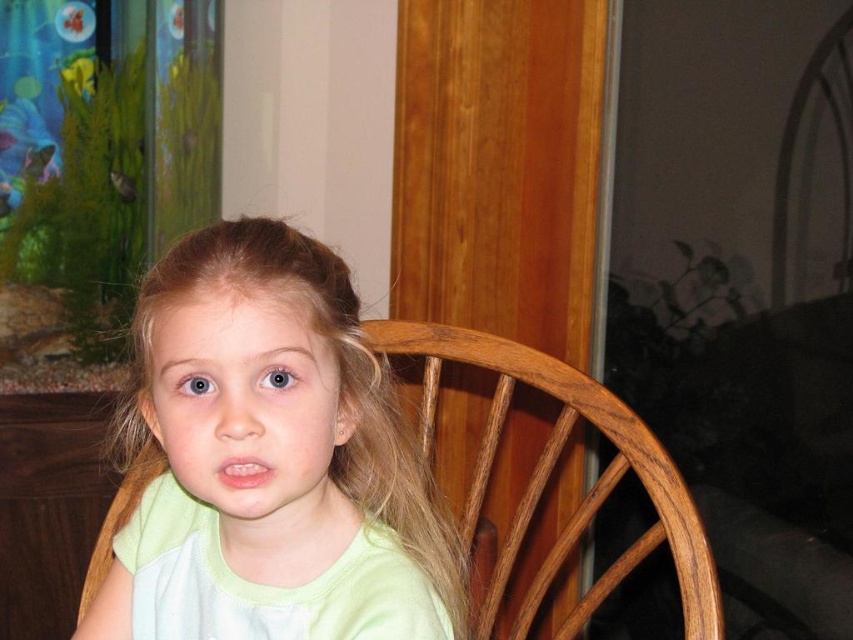
Can you confirm if wooden chair at center is shorter than green matte fish at upper left?

No.

Is point (683, 529) closer to viewer compared to point (9, 211)?

Yes, point (683, 529) is in front of point (9, 211).

This screenshot has width=853, height=640. I want to click on wooden chair at center, so click(550, 474).

Is wooden chair at center taller than shiny green fish at upper left?

Correct, wooden chair at center is much taller as shiny green fish at upper left.

Who is positioned more to the right, wooden chair at center or shiny green fish at upper left?

wooden chair at center

In order to click on wooden chair at center in this screenshot , I will do `click(550, 474)`.

Is point (42, 164) more distant than point (6, 202)?

Yes, it is behind point (6, 202).

Is the position of shiny green fish at upper left more distant than that of green matte fish at upper left?

Yes, shiny green fish at upper left is further from the viewer.

Find the location of a particular element. shiny green fish at upper left is located at coordinates (38, 161).